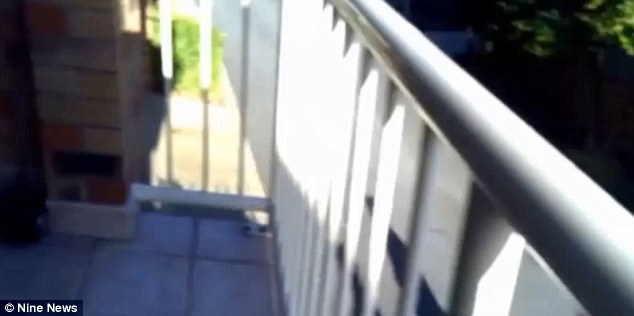
Locate an element on the screen. right corner tile is located at coordinates (212, 241).